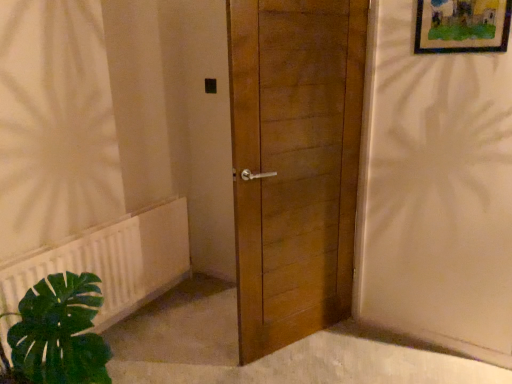
Question: Does point (502, 9) appear closer or farther from the camera than point (257, 3)?

Choices:
 (A) farther
 (B) closer

Answer: (A)

Question: From a real-world perspective, is wooden framed artwork at upper right positioned above or below wooden door at center?

Choices:
 (A) below
 (B) above

Answer: (B)

Question: Which object is positioned farthest from the wooden door at center?

Choices:
 (A) wooden framed artwork at upper right
 (B) white plastic radiator at lower left

Answer: (B)

Question: Based on their relative distances, which object is farther from the wooden door at center?

Choices:
 (A) wooden framed artwork at upper right
 (B) white plastic radiator at lower left

Answer: (B)